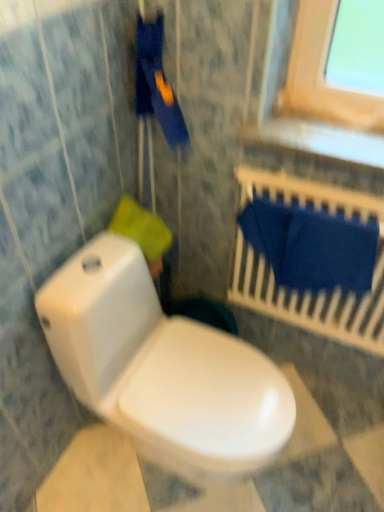
Question: Is point (72, 346) positioned closer to the camera than point (160, 250)?

Choices:
 (A) closer
 (B) farther

Answer: (A)

Question: Looking at the image, does white glossy toilet at lower left seem bigger or smaller compared to yellow fabric at upper left?

Choices:
 (A) small
 (B) big

Answer: (B)

Question: Which is farther from the yellow fabric at upper left?

Choices:
 (A) white glossy toilet at lower left
 (B) blue fabric at upper right

Answer: (B)

Question: Estimate the real-world distances between objects in this image. Which object is closer to the yellow fabric at upper left?

Choices:
 (A) blue fabric at upper right
 (B) white glossy toilet at lower left

Answer: (B)